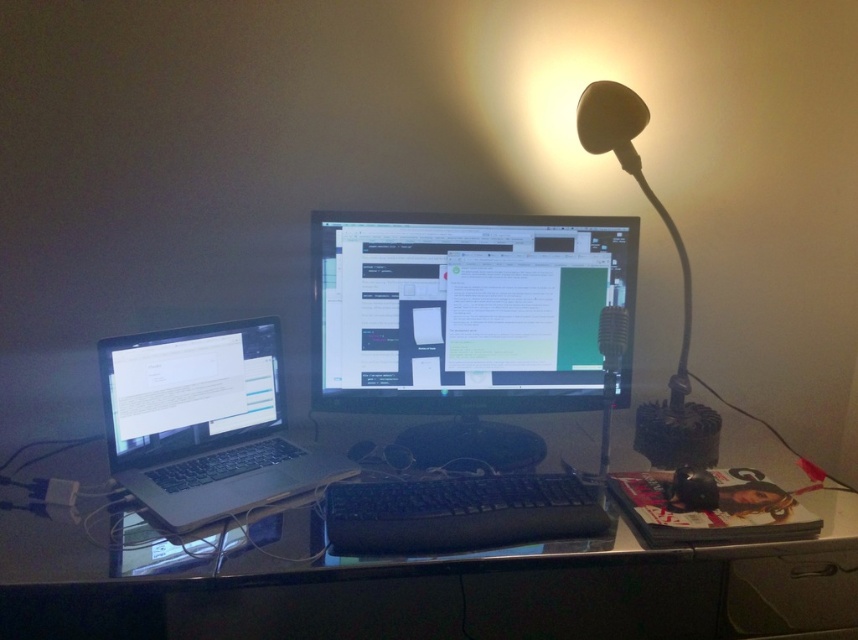
Is point (482, 525) more distant than point (699, 449)?

That is False.

Does black plastic keyboard at center appear on the right side of matte black lamp at upper right?

In fact, black plastic keyboard at center is to the left of matte black lamp at upper right.

Who is more forward, (521, 532) or (687, 452)?

Point (521, 532) is more forward.

The width and height of the screenshot is (858, 640). What are the coordinates of `black plastic keyboard at center` in the screenshot? It's located at (458, 513).

Is black plastic table at center to the left of silver metallic laptop at left from the viewer's perspective?

Incorrect, black plastic table at center is not on the left side of silver metallic laptop at left.

Does black plastic table at center have a greater height compared to silver metallic laptop at left?

Correct, black plastic table at center is much taller as silver metallic laptop at left.

The image size is (858, 640). In order to click on black plastic table at center in this screenshot , I will do `click(412, 584)`.

Find the location of `black plastic table at center`. black plastic table at center is located at coordinates (412, 584).

Which is above, black plastic table at center or black glossy monitor at center?

black glossy monitor at center is higher up.

Does black plastic table at center have a larger size compared to black glossy monitor at center?

Correct, black plastic table at center is larger in size than black glossy monitor at center.

Does point (599, 580) come closer to viewer compared to point (597, 282)?

No, (599, 580) is further to viewer.

Where is `black plastic table at center`? The width and height of the screenshot is (858, 640). black plastic table at center is located at coordinates (412, 584).